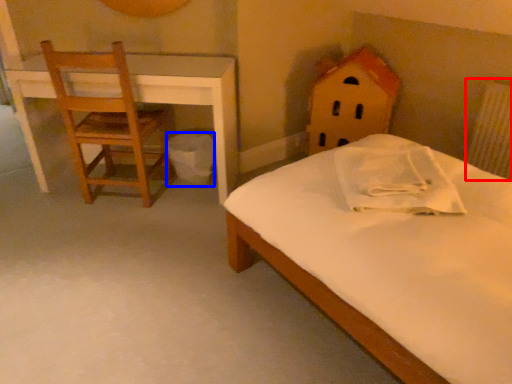
Question: Among these objects, which one is farthest to the camera, radiator (highlighted by a red box) or trash bin/can (highlighted by a blue box)?

Choices:
 (A) radiator
 (B) trash bin/can

Answer: (B)